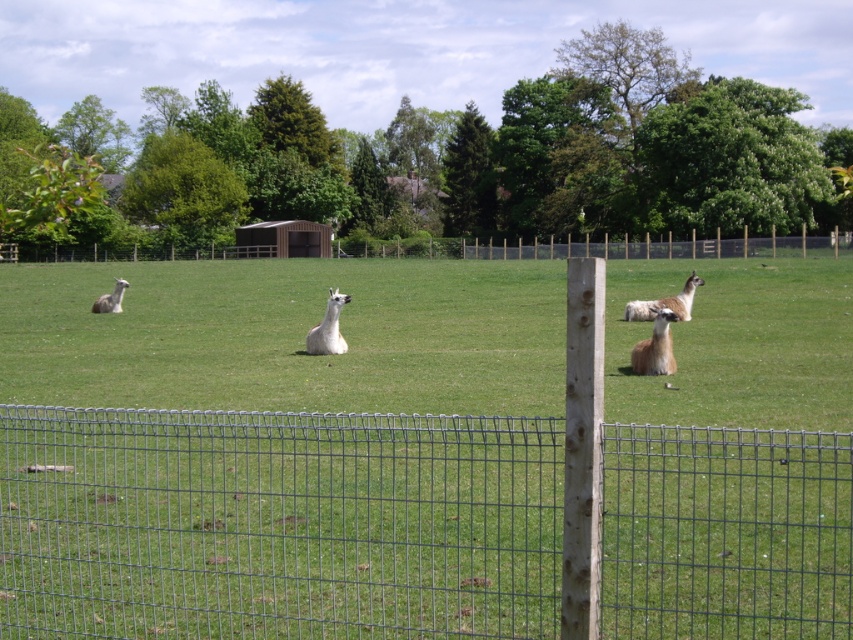
Question: Can you confirm if wire mesh fence at center is smaller than white woolly alpaca at left?

Choices:
 (A) yes
 (B) no

Answer: (A)

Question: Is wire mesh fence at center behind fuzzy white alpaca at center-right?

Choices:
 (A) yes
 (B) no

Answer: (B)

Question: Which of the following is the farthest from the observer?

Choices:
 (A) fuzzy white alpaca at center-right
 (B) wooden post at center
 (C) fuzzy brown alpaca at center-right
 (D) white woolly alpaca at center

Answer: (B)

Question: Is fuzzy brown alpaca at center-right wider than white woolly alpaca at left?

Choices:
 (A) yes
 (B) no

Answer: (B)

Question: Which object appears closest to the camera in this image?

Choices:
 (A) wooden post at center
 (B) wire mesh fence at center
 (C) white woolly alpaca at left

Answer: (B)

Question: Considering the real-world distances, which object is closest to the fuzzy white alpaca at center-right?

Choices:
 (A) wire mesh fence at center
 (B) wooden post at center
 (C) white woolly alpaca at center
 (D) fuzzy brown alpaca at center-right

Answer: (C)